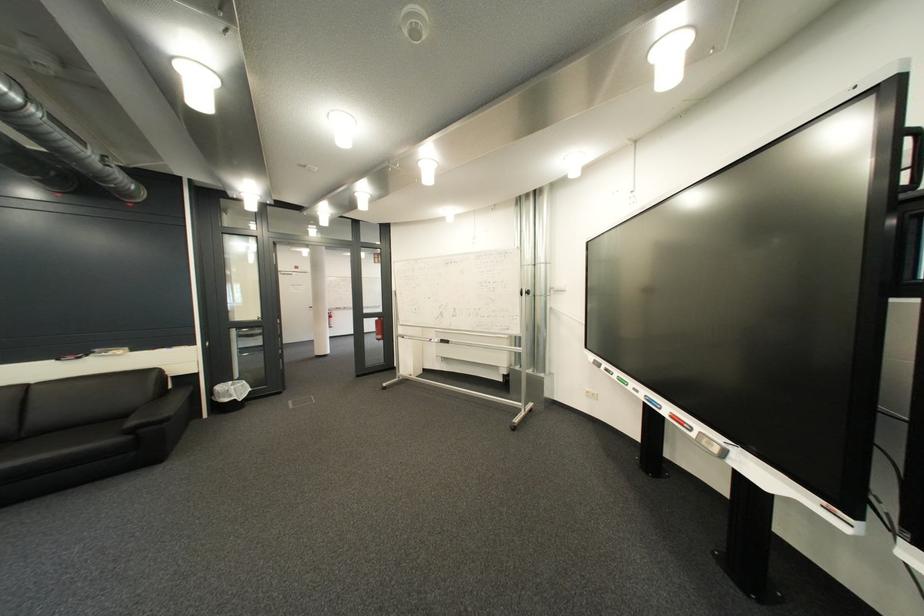
Locate an element on the screen. black sofa sitting surface is located at coordinates (63, 447).